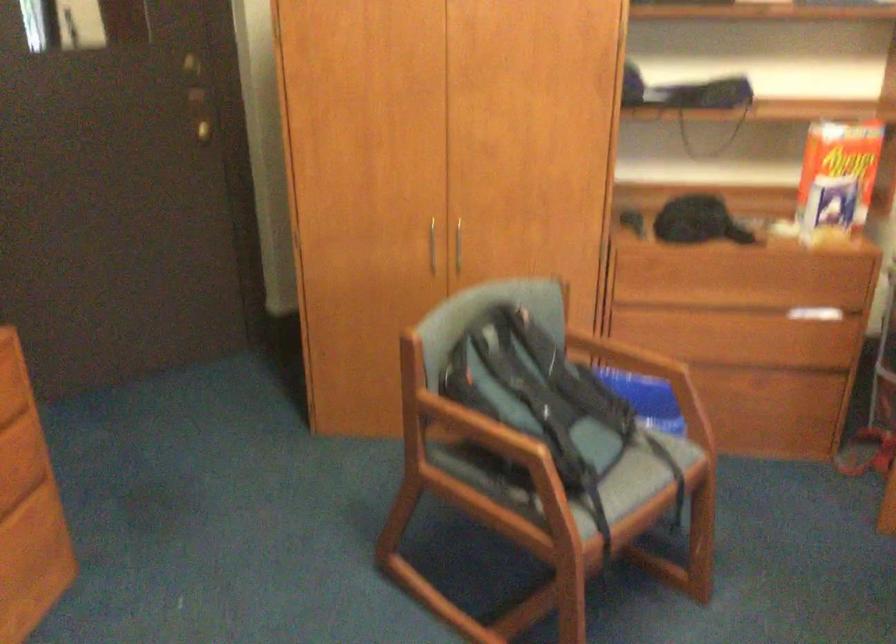
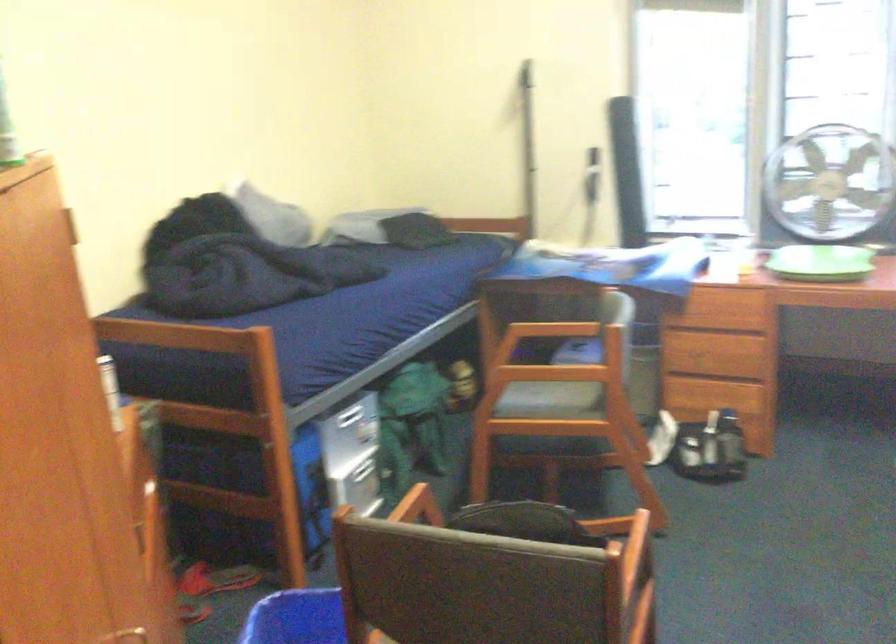
Find the pixel in the second image that matches the point at 530,277 in the first image.

(141, 630)